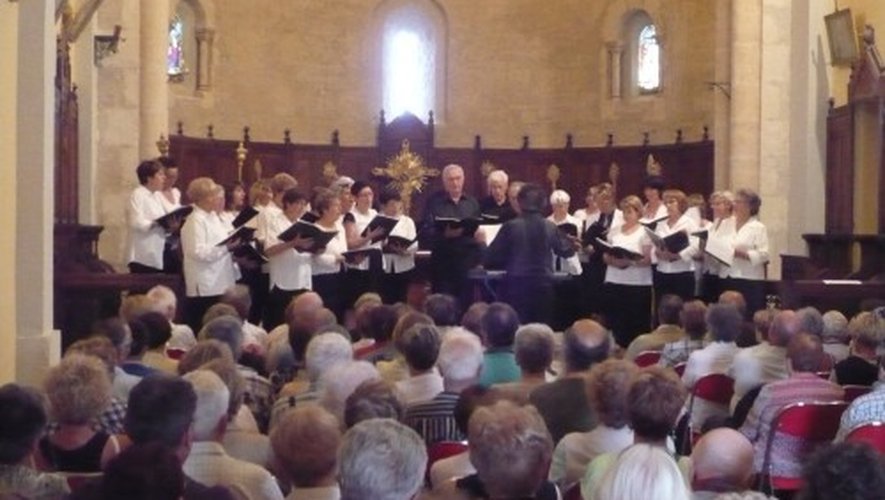
I want to click on flare of light shining through window, so click(x=404, y=70).